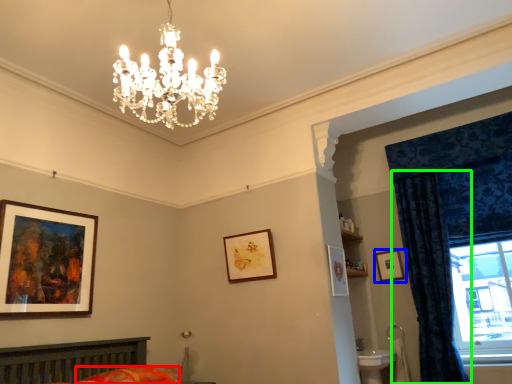
Question: Which object is positioned closest to bedding (highlighted by a red box)? Select from picture frame (highlighted by a blue box) and curtain (highlighted by a green box).

Choices:
 (A) picture frame
 (B) curtain

Answer: (A)